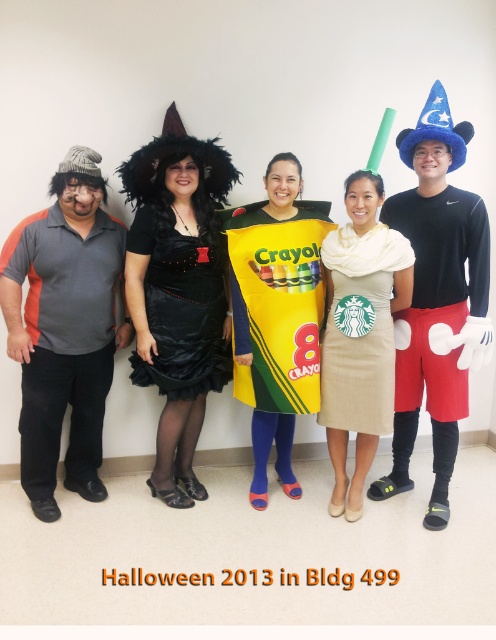
Question: Is yellow fabric crayon at center thinner than black satin dress at center?

Choices:
 (A) yes
 (B) no

Answer: (B)

Question: Does blue felt hat at upper right come behind yellow fabric crayon at center?

Choices:
 (A) no
 (B) yes

Answer: (A)

Question: Is gray matte shirt at left positioned at the back of beige textured dress at center?

Choices:
 (A) no
 (B) yes

Answer: (B)

Question: Among these objects, which one is nearest to the camera?

Choices:
 (A) yellow matte crayon at center
 (B) gray matte shirt at left

Answer: (B)

Question: Which point is closer to the camera?

Choices:
 (A) coord(8,301)
 (B) coord(245,241)
 (C) coord(377,374)
 (D) coord(409,433)

Answer: (A)

Question: Which is nearer to the black satin dress at center?

Choices:
 (A) yellow fabric crayon at center
 (B) beige textured dress at center
 (C) yellow matte crayon at center

Answer: (A)